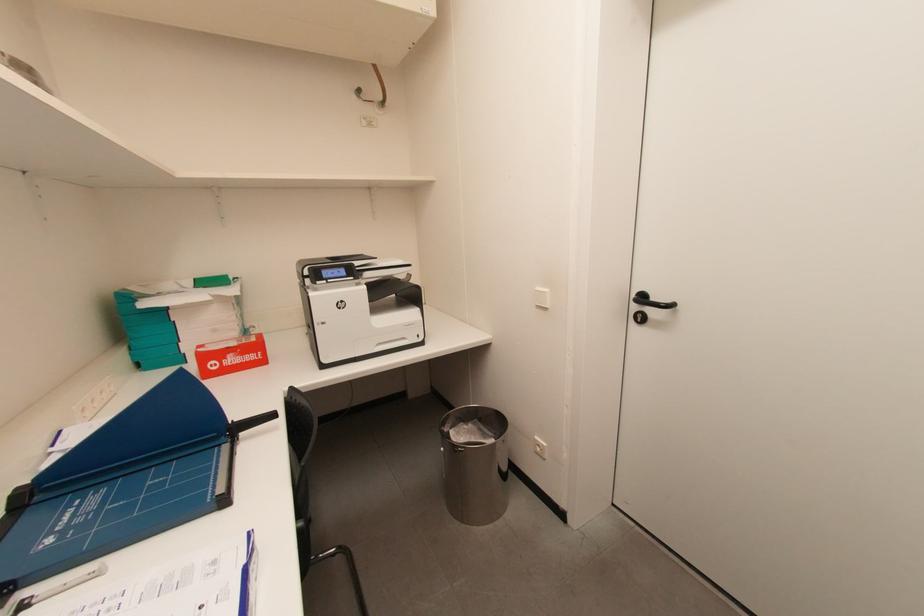
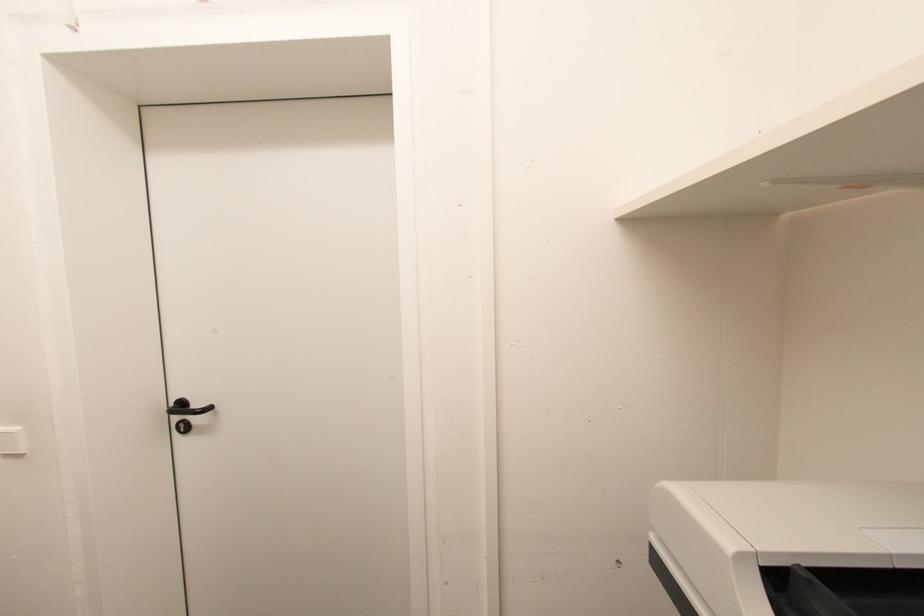
Question: The camera is either moving clockwise (left) or counter-clockwise (right) around the object. The first image is from the beginning of the video and the second image is from the end. Is the camera moving left or right when shooting the video?

Choices:
 (A) Left
 (B) Right

Answer: (A)